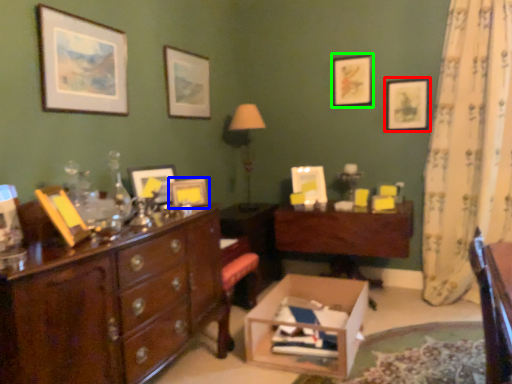
Question: Based on their relative distances, which object is nearer to picture frame (highlighted by a red box)? Choose from picture frame (highlighted by a blue box) and picture frame (highlighted by a green box).

Choices:
 (A) picture frame
 (B) picture frame

Answer: (B)